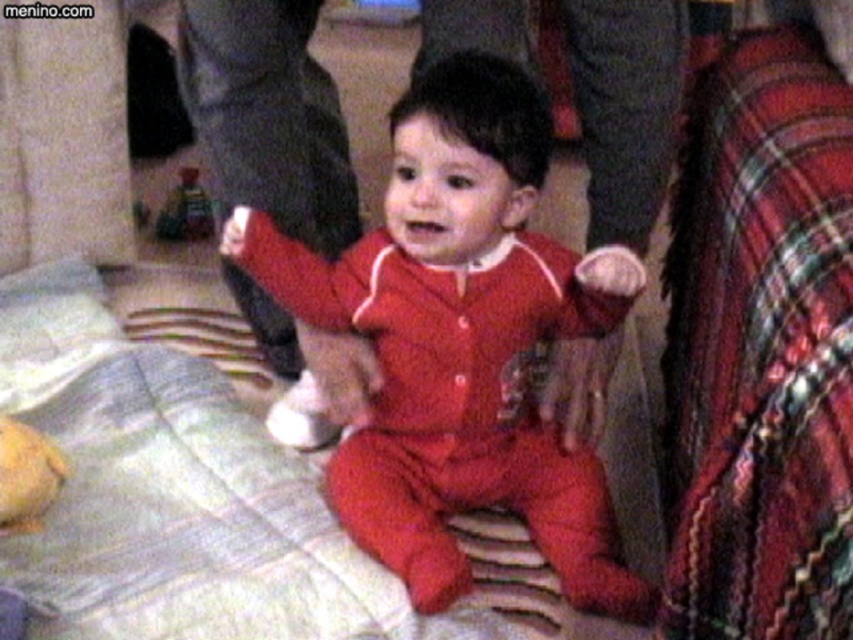
In the scene shown: Who is positioned more to the left, matte red pajamas at center or plastic toy at center?

Positioned to the left is plastic toy at center.

Measure the distance between point (537, 538) and camera.

1.20 meters

The width and height of the screenshot is (853, 640). In order to click on matte red pajamas at center in this screenshot , I will do `click(459, 339)`.